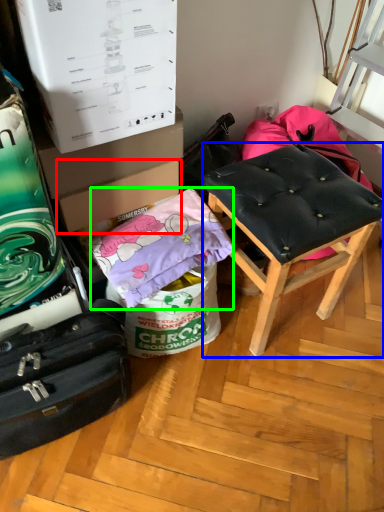
Question: Which object is the farthest from cardboard box (highlighted by a red box)? Choose among these: stool (highlighted by a blue box) or material (highlighted by a green box).

Choices:
 (A) stool
 (B) material

Answer: (A)